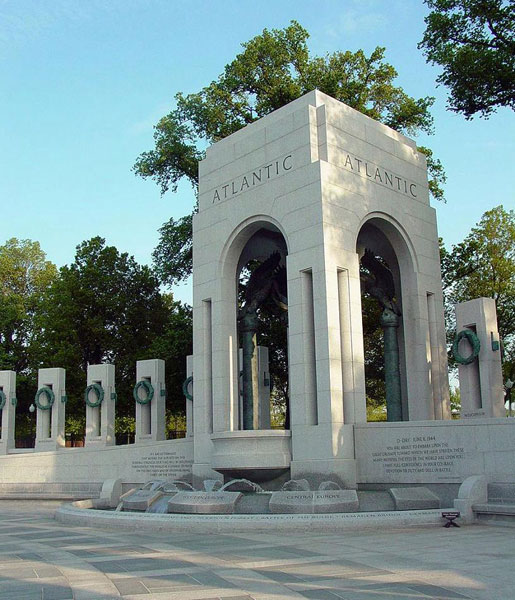
Where is `columns`? The image size is (515, 600). columns is located at coordinates (146, 374), (98, 372), (57, 385), (9, 374), (474, 307).